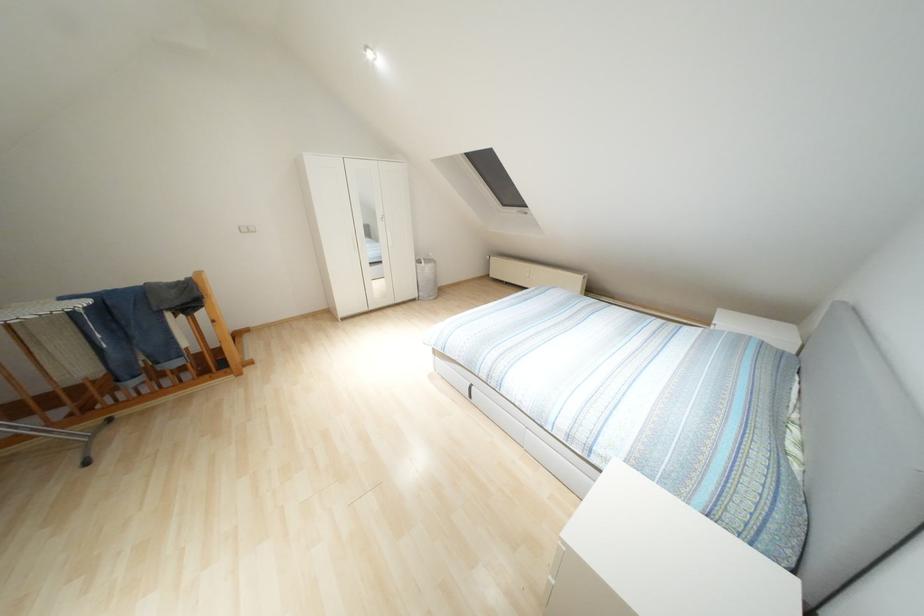
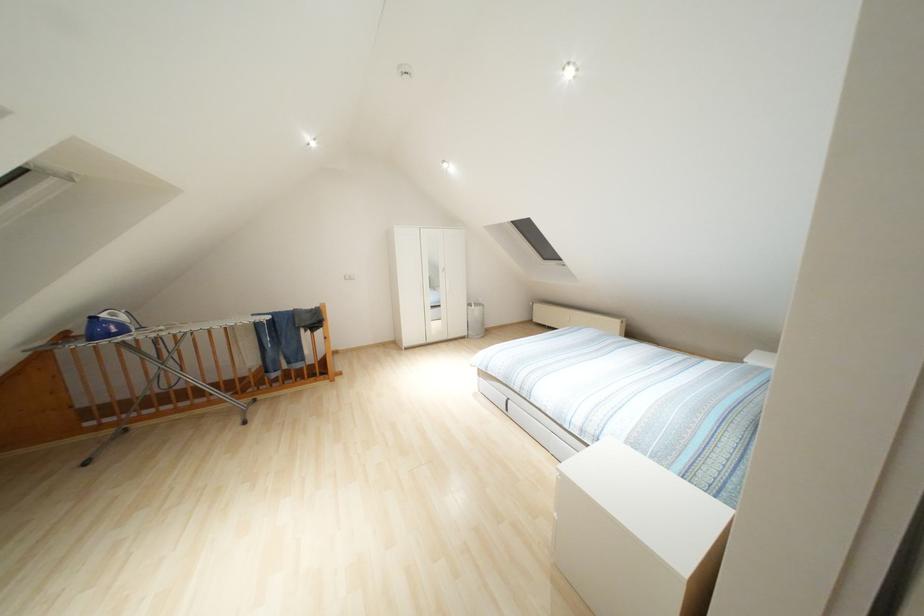
Question: The camera is either moving clockwise (left) or counter-clockwise (right) around the object. The first image is from the beginning of the video and the second image is from the end. Is the camera moving left or right when shooting the video?

Choices:
 (A) Left
 (B) Right

Answer: (B)